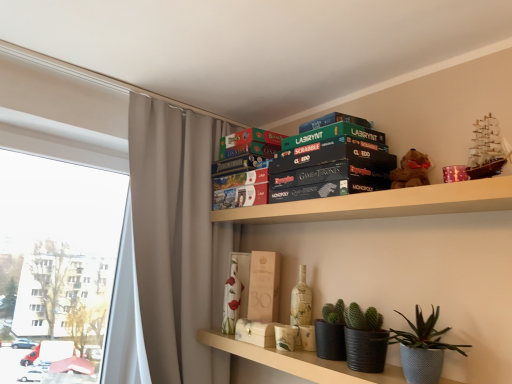
Question: Would you say wooden box at center, marked as the second paperback book in a top-to-bottom arrangement, is inside or outside wooden board game boxes at upper center, the first shelf from the top?

Choices:
 (A) outside
 (B) inside

Answer: (A)

Question: Relative to wooden board game boxes at upper center, placed as the 2th shelf when sorted from bottom to top, is wooden box at center, which is the 2th paperback book in left-to-right order, in front or behind?

Choices:
 (A) behind
 (B) front

Answer: (A)

Question: Which is nearer to the wooden board game boxes at upper center, placed as the 2th shelf when sorted from bottom to top?

Choices:
 (A) white textured vase at center, positioned as the 3th paperback book in right-to-left order
 (B) brown plush bear at upper right
 (C) textured gray pot at lower right
 (D) black cardboard game box at upper center
 (E) matte black pots at lower center, which appears as the 2th shelf when viewed from the top

Answer: (D)

Question: Which of these objects is positioned closest to the gray fabric curtain at upper left?

Choices:
 (A) transparent glass window at left
 (B) matte black pots at lower center, which appears as the 2th shelf when viewed from the top
 (C) white textured vase at center, the 1th paperback book when ordered from bottom to top
 (D) green matte board game at upper center, which is counted as the first paperback book, starting from the right
 (E) brown plush bear at upper right

Answer: (C)